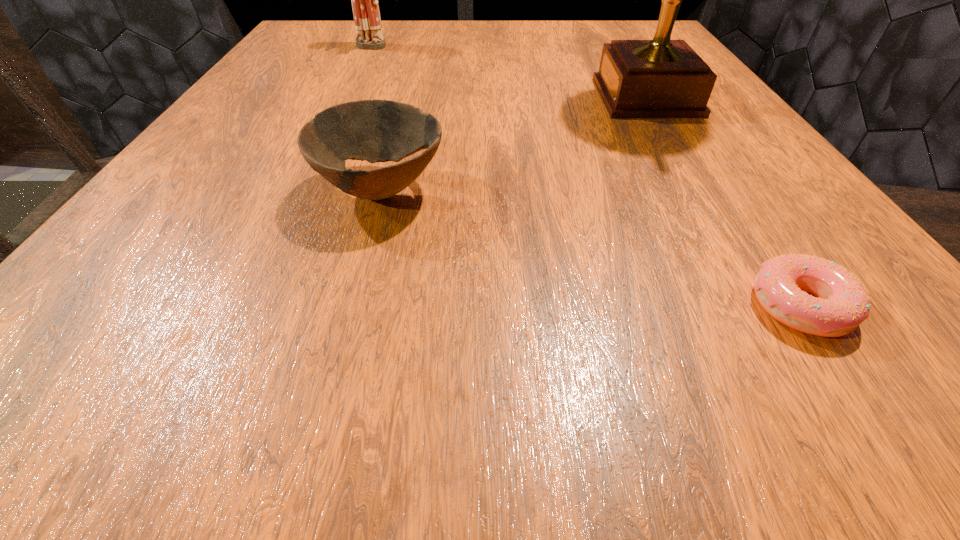
Where is `vacant space in between the third nearest object and the nearest object`? vacant space in between the third nearest object and the nearest object is located at coordinates (723, 201).

Identify the location of free space between the tallest object and the farthest object. This screenshot has width=960, height=540. (508, 72).

Identify the location of empty space that is in between the nearest object and the award. (723, 201).

Where is `vacant area between the farthest object and the nearest object`? The height and width of the screenshot is (540, 960). vacant area between the farthest object and the nearest object is located at coordinates coord(584,177).

Select which object appears as the third closest to the doughnut. Please provide its 2D coordinates. Your answer should be formatted as a tuple, i.e. [(x, y)], where the tuple contains the x and y coordinates of a point satisfying the conditions above.

[(366, 13)]

Locate which object is the closest to the farthest object. Please provide its 2D coordinates. Your answer should be formatted as a tuple, i.e. [(x, y)], where the tuple contains the x and y coordinates of a point satisfying the conditions above.

[(375, 130)]

Identify the location of vacant region that satisfies the following two spatial constraints: 1. on the plaque of the award; 2. on the left side of the doughnut. This screenshot has height=540, width=960. (772, 306).

At what (x,y) coordinates should I click in order to perform the action: click on vacant region that satisfies the following two spatial constraints: 1. on the front-facing side of the figurine; 2. on the right side of the second shortest object. Please return your answer as a coordinate pair (x, y). This screenshot has height=540, width=960. Looking at the image, I should click on (301, 190).

What are the coordinates of `vacant space that satisfies the following two spatial constraints: 1. on the front-facing side of the farthest object; 2. on the right side of the third farthest object` in the screenshot? It's located at (301, 190).

Find the location of a particular element. The width and height of the screenshot is (960, 540). free space in the image that satisfies the following two spatial constraints: 1. on the front-facing side of the doughnut; 2. on the right side of the farthest object is located at coordinates (245, 306).